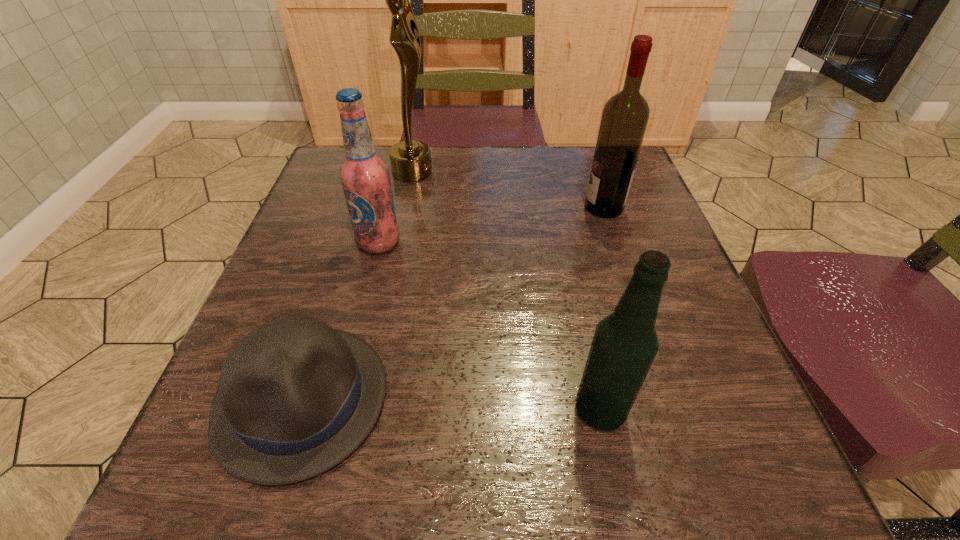
Where is `the farthest object`? the farthest object is located at coordinates (410, 160).

This screenshot has width=960, height=540. I want to click on the rightmost object, so click(625, 116).

Locate an element on the screen. The height and width of the screenshot is (540, 960). the rightmost alcohol is located at coordinates (625, 116).

Find the location of `the second nearest alcohol`. the second nearest alcohol is located at coordinates (365, 177).

You are a GUI agent. You are given a task and a screenshot of the screen. Output one action in this format:
    pyautogui.click(x=<x>, y=<y>)
    Task: Click on the leftmost alcohol
    The height and width of the screenshot is (540, 960).
    Given the screenshot: What is the action you would take?
    pyautogui.click(x=365, y=177)

At what (x,y) coordinates should I click in order to perform the action: click on the fourth object from left to right. Please return your answer as a coordinate pair (x, y). The width and height of the screenshot is (960, 540). Looking at the image, I should click on (625, 343).

Identify the location of the nearest alcohol. (625, 343).

Identify the location of the shortest object. (295, 397).

The height and width of the screenshot is (540, 960). I want to click on vacant space located on the front-facing side of the farthest object, so click(521, 171).

The image size is (960, 540). Identify the location of free location located on the front and back of the fourth nearest object. (517, 207).